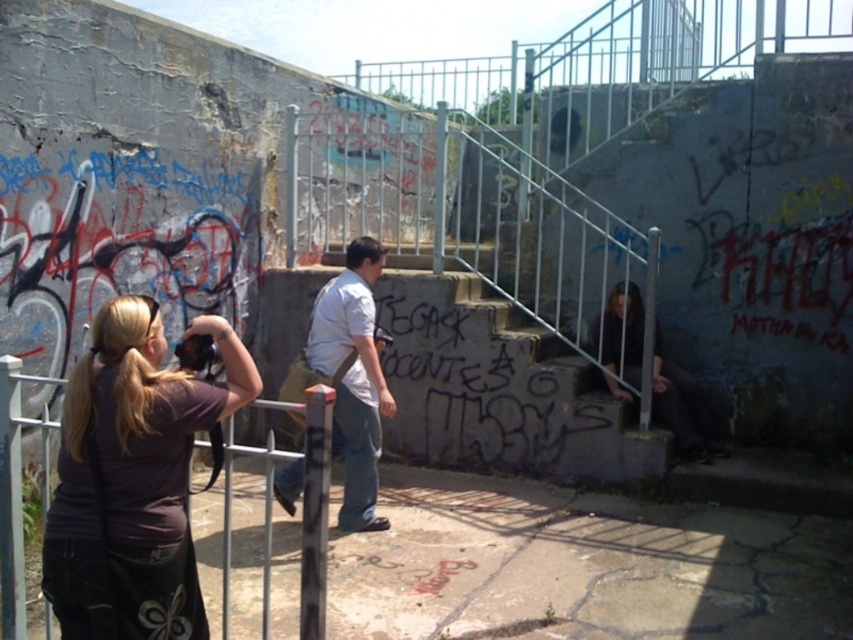
Question: Is matte purple shirt at left positioned behind dark gray fabric pants at lower right?

Choices:
 (A) no
 (B) yes

Answer: (A)

Question: Which point appears closest to the camera in this image?

Choices:
 (A) (368, 522)
 (B) (51, 513)

Answer: (B)

Question: Among these objects, which one is nearest to the camera?

Choices:
 (A) white cotton shirt at center
 (B) matte purple shirt at left

Answer: (B)

Question: Estimate the real-world distances between objects in this image. Which object is closer to the matte purple shirt at left?

Choices:
 (A) white cotton shirt at center
 (B) dark gray fabric pants at lower right

Answer: (A)

Question: Is matte purple shirt at left to the left of white cotton shirt at center from the viewer's perspective?

Choices:
 (A) yes
 (B) no

Answer: (A)

Question: Does matte purple shirt at left come in front of dark gray fabric pants at lower right?

Choices:
 (A) yes
 (B) no

Answer: (A)